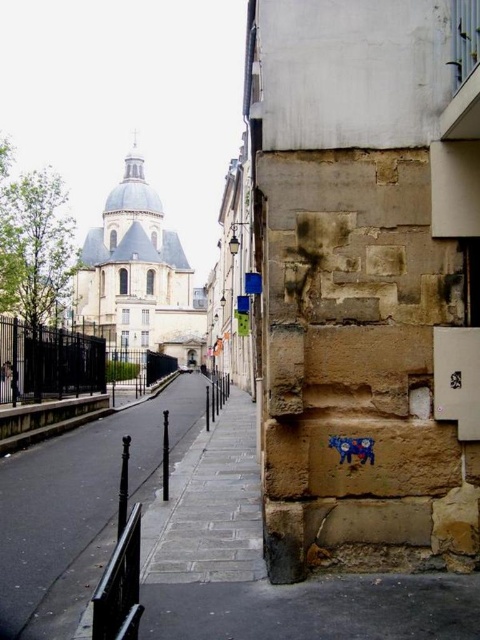
You are a delivery person trying to park your bike. The bike requires 2 meters of space to park. You see the black asphalt pavement at center and the black metal railing at lower left. Which location has enough space for your bike?

The black asphalt pavement at center has a larger width than the black metal railing at lower left, so the black asphalt pavement at center has enough space for the bike.

You are a delivery person with a cart that is 10 feet wide. You need to move your cart from the black metal railing at lower left to the black asphalt pavement at center. Is there enough space for your cart to pass through the area between them?

The distance between the black asphalt pavement at center and the black metal railing at lower left is 128.01 feet, which is significantly wider than the 10 feet width of your cart. Therefore, there is ample space for your cart to pass through the area between them.